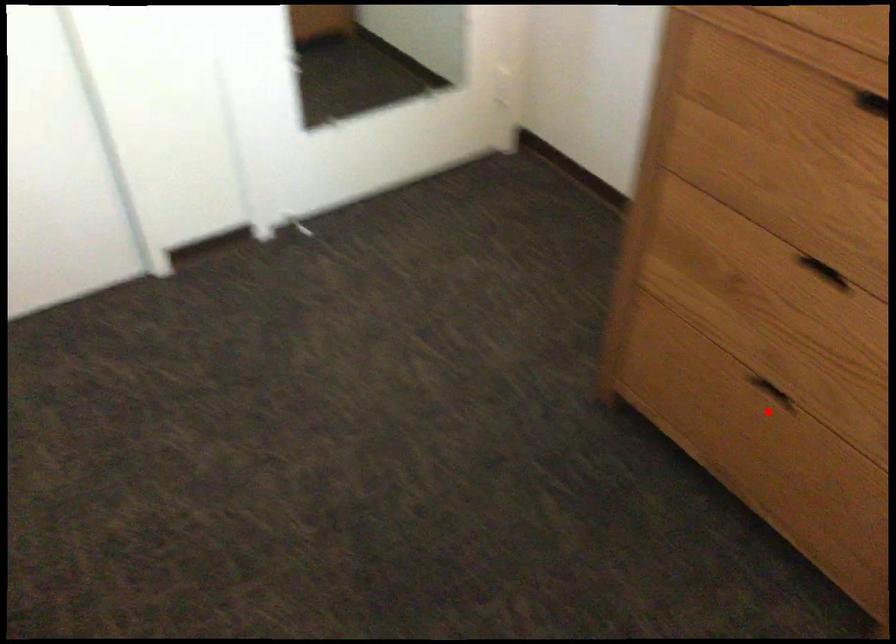
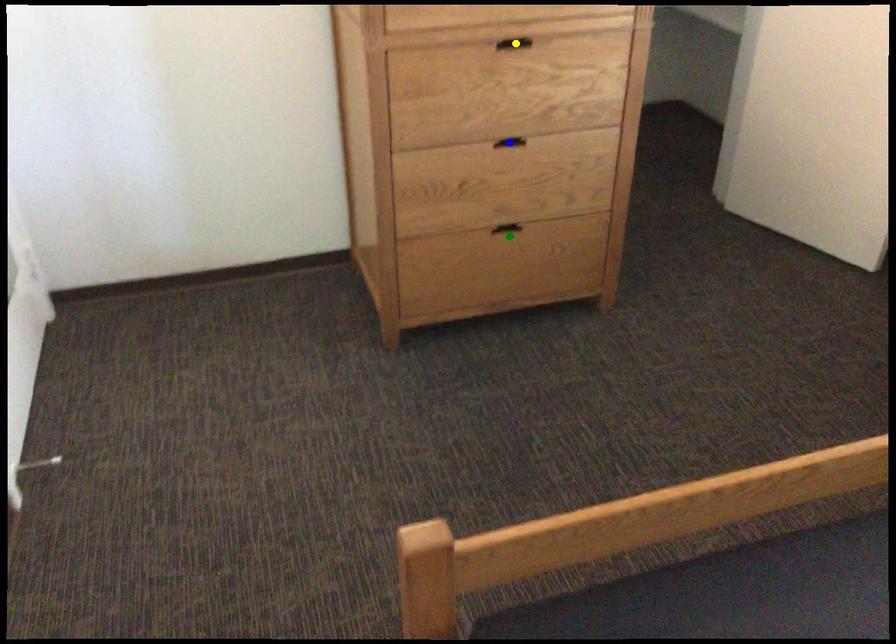
Question: I am providing you with two images of the same scene from different viewpoints. A red point is marked on the first image. You are given multiple points on the second image. Which mark in image 2 goes with the point in image 1?

Choices:
 (A) yellow point
 (B) green point
 (C) blue point

Answer: (B)